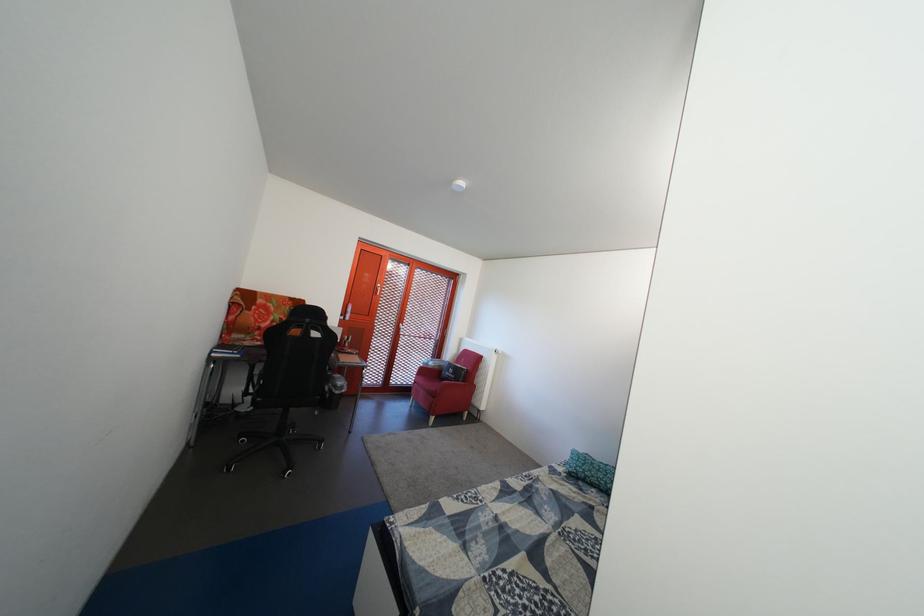
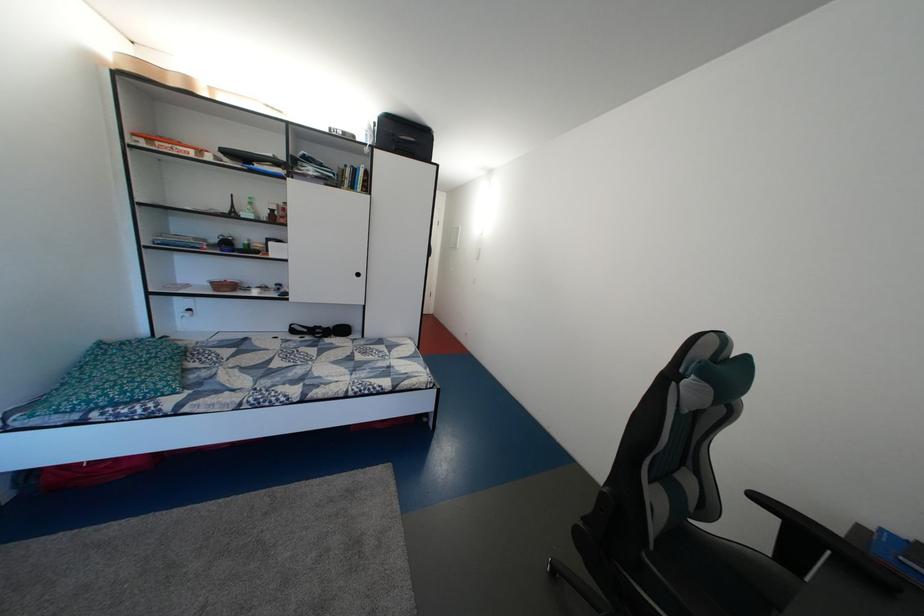
The point at (492, 520) is marked in the first image. Where is the corresponding point in the second image?

(373, 382)